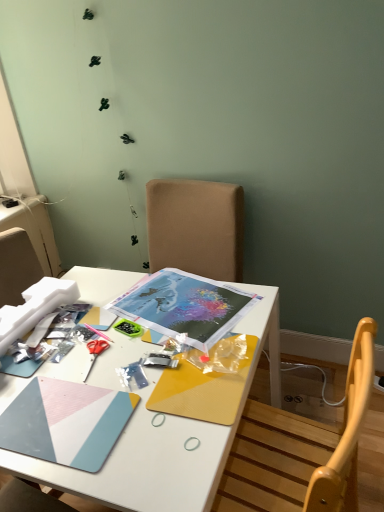
Question: Considering the relative positions of white matte desk at center and red plastic scissors at center-left in the image provided, is white matte desk at center behind red plastic scissors at center-left?

Choices:
 (A) yes
 (B) no

Answer: (B)

Question: Is white matte desk at center at the right side of red plastic scissors at center-left?

Choices:
 (A) no
 (B) yes

Answer: (B)

Question: From the image's perspective, is white matte desk at center located above red plastic scissors at center-left?

Choices:
 (A) yes
 (B) no

Answer: (B)

Question: Considering the relative sizes of white matte desk at center and red plastic scissors at center-left in the image provided, is white matte desk at center bigger than red plastic scissors at center-left?

Choices:
 (A) yes
 (B) no

Answer: (A)

Question: Is white matte desk at center not near red plastic scissors at center-left?

Choices:
 (A) no
 (B) yes

Answer: (A)

Question: Can you confirm if white matte desk at center is thinner than red plastic scissors at center-left?

Choices:
 (A) no
 (B) yes

Answer: (A)

Question: Is red plastic scissors at center-left thinner than white matte desk at center?

Choices:
 (A) no
 (B) yes

Answer: (B)

Question: From the image's perspective, is red plastic scissors at center-left over white matte desk at center?

Choices:
 (A) yes
 (B) no

Answer: (A)

Question: Is red plastic scissors at center-left shorter than white matte desk at center?

Choices:
 (A) no
 (B) yes

Answer: (B)

Question: Are red plastic scissors at center-left and white matte desk at center located far from each other?

Choices:
 (A) yes
 (B) no

Answer: (B)

Question: Does red plastic scissors at center-left lie behind white matte desk at center?

Choices:
 (A) yes
 (B) no

Answer: (A)

Question: Is the depth of red plastic scissors at center-left less than that of white matte desk at center?

Choices:
 (A) no
 (B) yes

Answer: (A)

Question: Considering the positions of red plastic scissors at center-left and white matte desk at center in the image, is red plastic scissors at center-left bigger or smaller than white matte desk at center?

Choices:
 (A) big
 (B) small

Answer: (B)